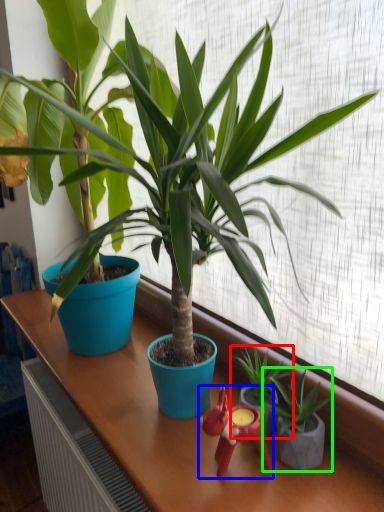
Question: Considering the real-world distances, which object is farthest from houseplant (highlighted by a red box)? miniature (highlighted by a blue box) or houseplant (highlighted by a green box)?

Choices:
 (A) miniature
 (B) houseplant

Answer: (A)